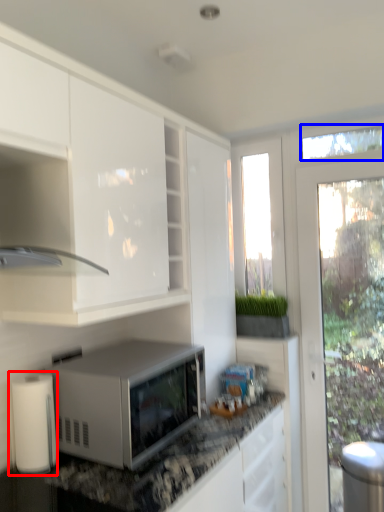
Question: Which point is closer to the camera, paper towel (highlighted by a red box) or window screen (highlighted by a blue box)?

Choices:
 (A) paper towel
 (B) window screen

Answer: (A)